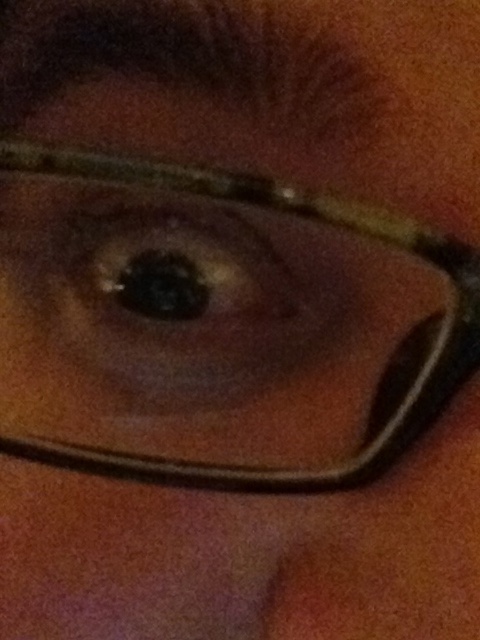
Question: Does matte brown glasses at center appear on the right side of brown matte eye at center?

Choices:
 (A) no
 (B) yes

Answer: (B)

Question: From the image, what is the correct spatial relationship of matte brown glasses at center in relation to brown matte eye at center?

Choices:
 (A) above
 (B) below

Answer: (B)

Question: Which point is farther to the camera?

Choices:
 (A) tap(308, 474)
 (B) tap(283, 305)

Answer: (B)

Question: Considering the relative positions of matte brown glasses at center and brown matte eye at center in the image provided, where is matte brown glasses at center located with respect to brown matte eye at center?

Choices:
 (A) above
 (B) below

Answer: (B)

Question: Which point is farther to the camera?

Choices:
 (A) pyautogui.click(x=67, y=464)
 (B) pyautogui.click(x=190, y=250)

Answer: (B)